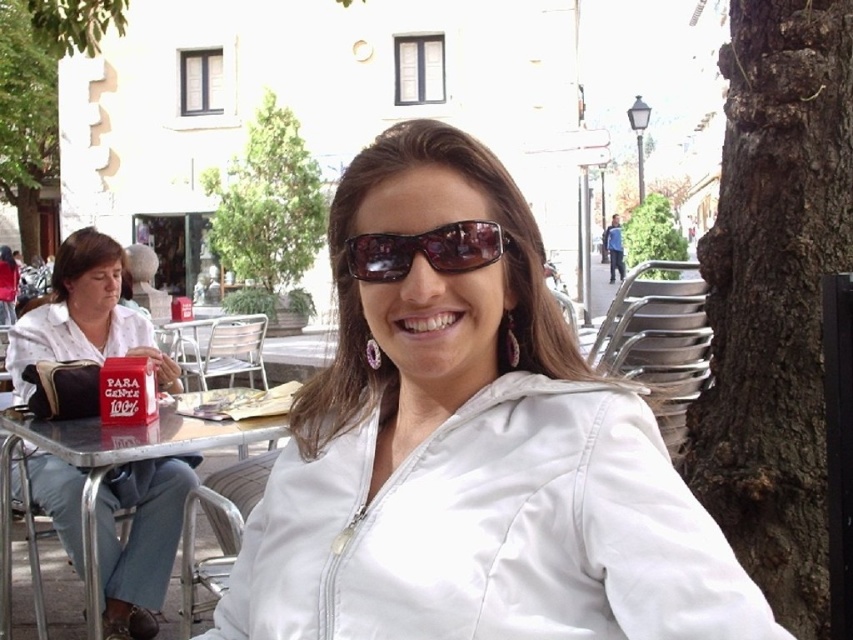
Question: Estimate the real-world distances between objects in this image. Which object is farther from the white fabric shirt at left?

Choices:
 (A) sunglasses at center
 (B) metallic silver table at lower left
 (C) green leafy tree at center
 (D) green leafy tree at upper center

Answer: (C)

Question: Among these objects, which one is nearest to the camera?

Choices:
 (A) white fabric shirt at left
 (B) metallic silver table at lower left
 (C) white matte jacket at center
 (D) sunglasses at center

Answer: (C)

Question: From the image, what is the correct spatial relationship of brown rough bark tree at right in relation to white fabric shirt at left?

Choices:
 (A) left
 (B) right

Answer: (B)

Question: Does brown rough bark tree at right have a lesser width compared to green leafy tree at upper center?

Choices:
 (A) yes
 (B) no

Answer: (A)

Question: Which point appears closest to the camera in this image?

Choices:
 (A) (47, 179)
 (B) (308, 250)

Answer: (B)

Question: Considering the relative positions of white matte jacket at center and brown rough bark tree at right in the image provided, where is white matte jacket at center located with respect to brown rough bark tree at right?

Choices:
 (A) left
 (B) right

Answer: (A)